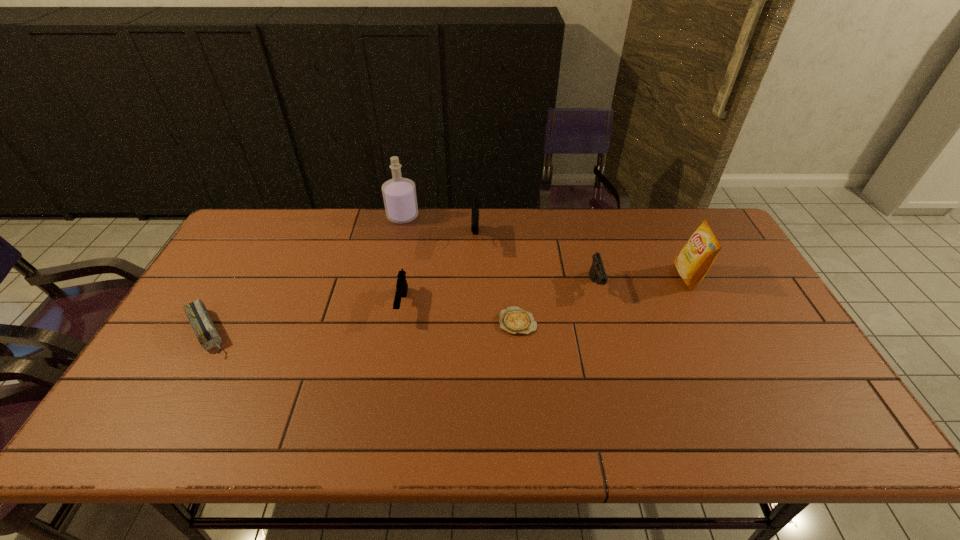
Identify the location of the tallest object. The height and width of the screenshot is (540, 960). (399, 194).

Locate an element on the screen. The image size is (960, 540). the sixth shortest object is located at coordinates (695, 259).

Image resolution: width=960 pixels, height=540 pixels. I want to click on the rightmost object, so click(695, 259).

You are a GUI agent. You are given a task and a screenshot of the screen. Output one action in this format:
    pyautogui.click(x=<x>, y=<y>)
    Task: Click on the second pistol from right to left
    This screenshot has height=540, width=960.
    Given the screenshot: What is the action you would take?
    pyautogui.click(x=475, y=203)

Identify the location of the third tallest object. (475, 203).

The width and height of the screenshot is (960, 540). What are the coordinates of `the rightmost pistol` in the screenshot? It's located at (597, 273).

I want to click on the leftmost pistol, so click(x=401, y=287).

What are the coordinates of `pencil box` in the screenshot? It's located at (207, 334).

Locate an element on the screen. This screenshot has height=540, width=960. the leftmost object is located at coordinates (207, 334).

Find the location of `quiche`. quiche is located at coordinates (514, 320).